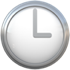
Image resolution: width=70 pixels, height=70 pixels. In order to click on clock in this screenshot , I will do `click(55, 51)`.